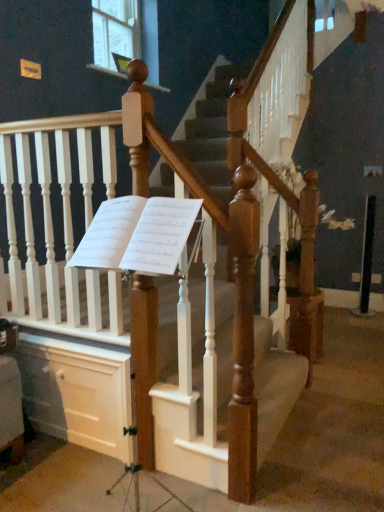
Question: Is white paper sheet music at center positioned behind clear glass window at upper center?

Choices:
 (A) yes
 (B) no

Answer: (B)

Question: From a real-world perspective, is white paper sheet music at center located beneath clear glass window at upper center?

Choices:
 (A) no
 (B) yes

Answer: (B)

Question: From the image's perspective, is white paper sheet music at center below clear glass window at upper center?

Choices:
 (A) yes
 (B) no

Answer: (A)

Question: Is white paper sheet music at center oriented towards clear glass window at upper center?

Choices:
 (A) yes
 (B) no

Answer: (B)

Question: Can you confirm if white paper sheet music at center is positioned to the right of clear glass window at upper center?

Choices:
 (A) no
 (B) yes

Answer: (B)

Question: From a real-world perspective, does white paper sheet music at center stand above clear glass window at upper center?

Choices:
 (A) no
 (B) yes

Answer: (A)

Question: From the image's perspective, is clear glass window at upper center over white paper sheet music at center?

Choices:
 (A) yes
 (B) no

Answer: (A)

Question: Is clear glass window at upper center thinner than white paper sheet music at center?

Choices:
 (A) no
 (B) yes

Answer: (B)

Question: From the image's perspective, is clear glass window at upper center under white paper sheet music at center?

Choices:
 (A) no
 (B) yes

Answer: (A)

Question: Can white paper sheet music at center be found inside clear glass window at upper center?

Choices:
 (A) no
 (B) yes

Answer: (A)

Question: Considering the relative sizes of clear glass window at upper center and white paper sheet music at center in the image provided, is clear glass window at upper center smaller than white paper sheet music at center?

Choices:
 (A) no
 (B) yes

Answer: (B)

Question: Is clear glass window at upper center wider than white paper sheet music at center?

Choices:
 (A) yes
 (B) no

Answer: (B)

Question: From a real-world perspective, is white paper sheet music at center physically above wooden staircase at center?

Choices:
 (A) no
 (B) yes

Answer: (B)